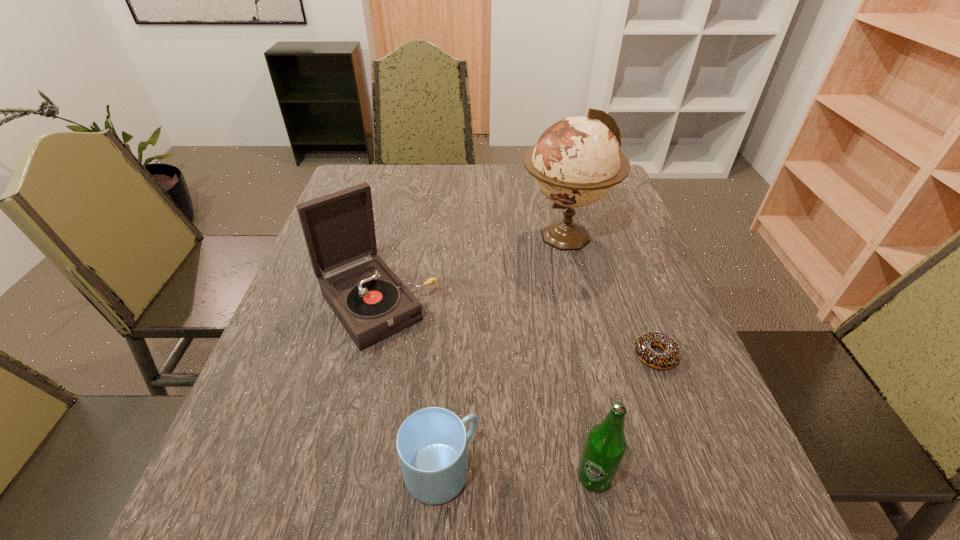
What are the coordinates of `the third closest object to the mug` in the screenshot? It's located at (670, 358).

Where is `the third closest object to the shortest object`? The image size is (960, 540). the third closest object to the shortest object is located at coordinates (431, 443).

Find the location of a particular element. This screenshot has width=960, height=540. free spot that satisfies the following two spatial constraints: 1. on the front of the shortest object showing Asia; 2. on the right side of the farthest object is located at coordinates (593, 355).

This screenshot has height=540, width=960. I want to click on free space that satisfies the following two spatial constraints: 1. on the front of the shortest object showing Asia; 2. on the right side of the globe, so click(x=593, y=355).

At what (x,y) coordinates should I click in order to perform the action: click on free space in the image that satisfies the following two spatial constraints: 1. on the front side of the second tallest object; 2. on the right side of the second shortest object. Please return your answer as a coordinate pair (x, y). The width and height of the screenshot is (960, 540). Looking at the image, I should click on (335, 471).